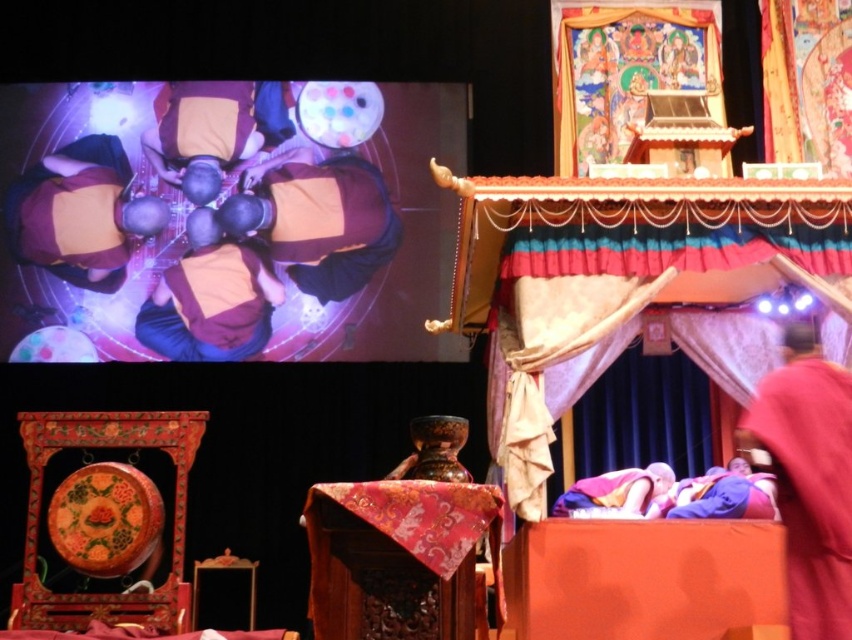
You are an interior designer planning to place a new lamp in the room. The lamp requires a surface that is at least 1.2 meters in height to be stable. Based on the scene, which object between the velvet draped canopy bed at upper center and the red velvet robe at lower right would be suitable for placing the lamp?

The velvet draped canopy bed at upper center is much taller than the red velvet robe at lower right, so the lamp can be placed on the velvet draped canopy bed at upper center since it meets the height requirement of 1.2 meters.

You are an anthropologist observing the scene and need to document the items. Which item, the brown leather purse at upper center or the orange cotton robe at center, would you need to adjust your camera angle upwards to capture properly?

The brown leather purse at upper center is much taller than the orange cotton robe at center, so you would need to adjust your camera angle upwards to capture the brown leather purse at upper center properly.

You are an attendee at this ceremony and notice both the brown leather purse at upper center and the orange cotton robe at center. Which item is located higher up in the scene?

The brown leather purse at upper center is positioned over the orange cotton robe at center, so it is higher up.